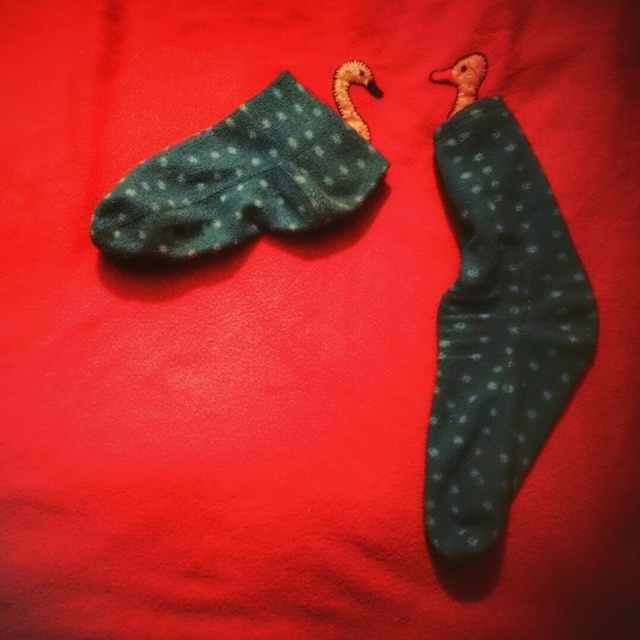
From the picture: You are organizing a sock drawer and notice the dark green dotted sock at upper right and the dark green fuzzy socks at upper left. Which sock is closer to the bottom of the drawer?

The dark green dotted sock at upper right is positioned under the dark green fuzzy socks at upper left, so it is closer to the bottom of the drawer.

You are organizing a sock display and need to arrange the dark green dotted sock at upper right and the dark green fuzzy socks at upper left on a shelf. The shelf has a height limit of 12 inches. Which sock should you place first to ensure both fit within the height limit?

The dark green dotted sock at upper right is much taller than the dark green fuzzy socks at upper left. To ensure both fit within the 12 inch height limit, place the dark green fuzzy socks at upper left first, then the dark green dotted sock at upper right, as the total height would be the sum of both, but since the dotted sock is taller, stacking them with the shorter one first might help optimize space. However, if the taller sock alone exceeds 12 inches, neither can fit. Without exact measurements, it is